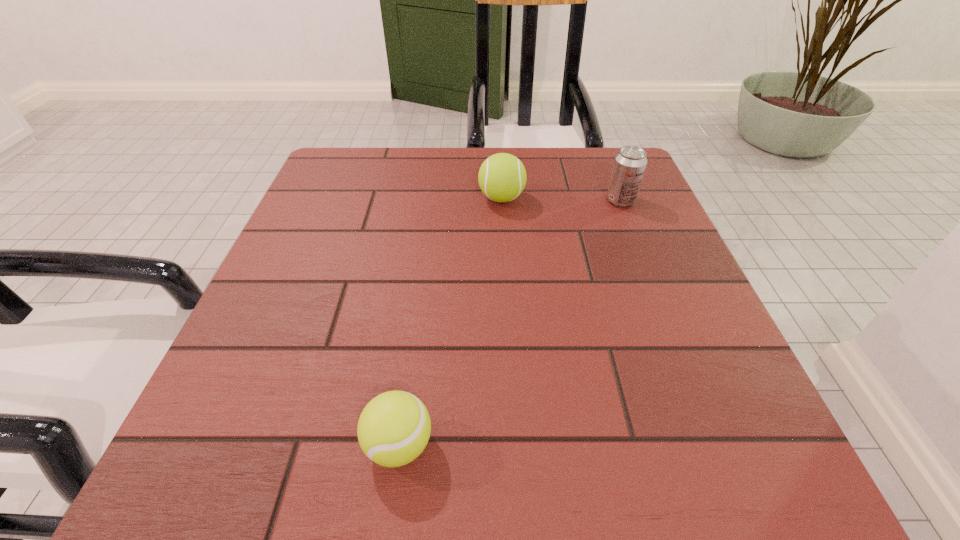
You are a GUI agent. You are given a task and a screenshot of the screen. Output one action in this format:
    pyautogui.click(x=<x>, y=<y>)
    Task: Click on the rightmost object
    This screenshot has width=960, height=540.
    Given the screenshot: What is the action you would take?
    pyautogui.click(x=630, y=163)

Where is `the farther tennis ball`? Image resolution: width=960 pixels, height=540 pixels. the farther tennis ball is located at coordinates (502, 177).

You are a GUI agent. You are given a task and a screenshot of the screen. Output one action in this format:
    pyautogui.click(x=<x>, y=<y>)
    Task: Click on the second object from right to left
    This screenshot has width=960, height=540.
    Given the screenshot: What is the action you would take?
    tap(502, 177)

Locate an element on the screen. This screenshot has width=960, height=540. the shortest object is located at coordinates (394, 427).

Locate an element on the screen. The width and height of the screenshot is (960, 540). the left tennis ball is located at coordinates (394, 427).

At what (x,y) coordinates should I click in order to perform the action: click on vacant space positioned on the left of the rightmost object. Please return your answer as a coordinate pair (x, y). This screenshot has height=540, width=960. Looking at the image, I should click on (456, 201).

What are the coordinates of `vacant region located on the right of the right tennis ball` in the screenshot? It's located at (584, 198).

Find the location of a particular element. vacant space positioned 0.160m on the right of the left tennis ball is located at coordinates (557, 445).

Find the location of a particular element. This screenshot has width=960, height=540. beer can situated at the far edge is located at coordinates (630, 163).

The image size is (960, 540). I want to click on tennis ball at the far edge, so click(x=502, y=177).